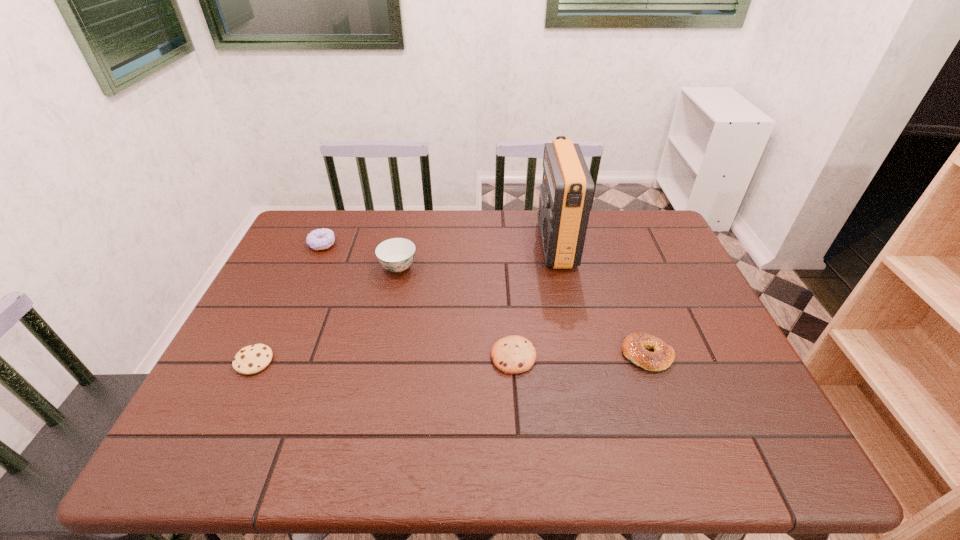
The height and width of the screenshot is (540, 960). I want to click on free space located 0.330m on the front-facing side of the radio receiver, so click(435, 244).

I want to click on vacant space located 0.080m on the left of the second tallest object, so click(351, 267).

What are the coordinates of `free point located on the back of the doughnut` in the screenshot? It's located at (336, 214).

Identify the location of vacant space located on the back of the rightmost object. (611, 254).

The height and width of the screenshot is (540, 960). I want to click on vacant space located 0.380m on the right of the right cookie, so click(x=695, y=356).

Where is `free space located on the back of the left cookie`? free space located on the back of the left cookie is located at coordinates (279, 309).

Locate an element on the screen. radio receiver positioned at the far edge is located at coordinates (566, 193).

I want to click on doughnut positioned at the far edge, so click(x=320, y=239).

Locate an element on the screen. The image size is (960, 540). doughnut positioned at the left edge is located at coordinates (320, 239).

Locate an element on the screen. The image size is (960, 540). cookie that is positioned at the left edge is located at coordinates (249, 360).